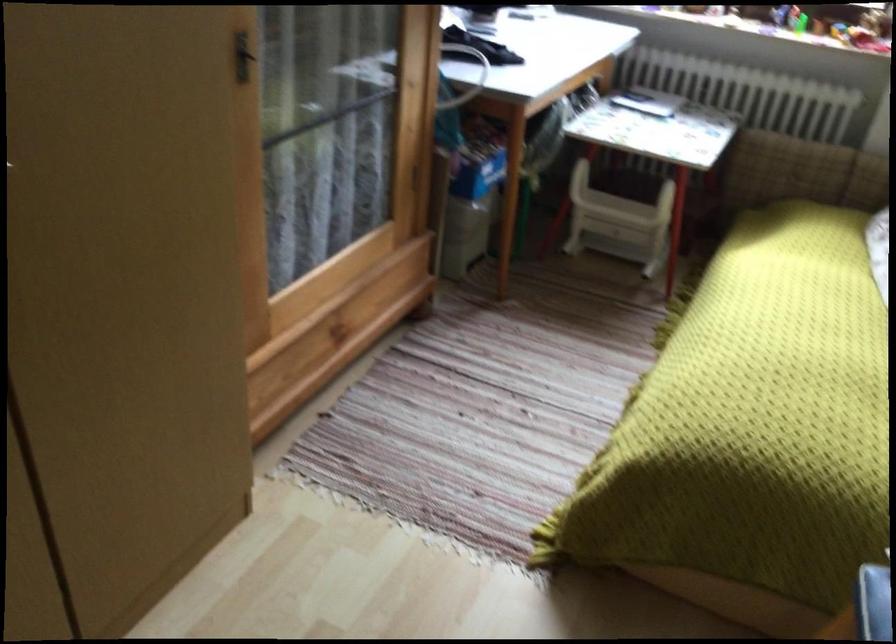
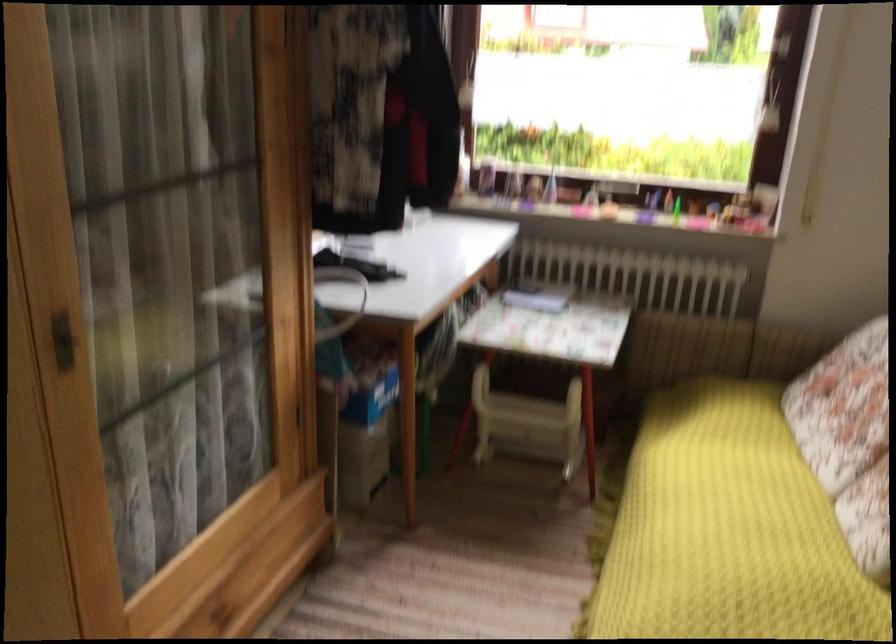
Find the pixel in the second image that matches point (616, 220) in the first image.

(528, 424)